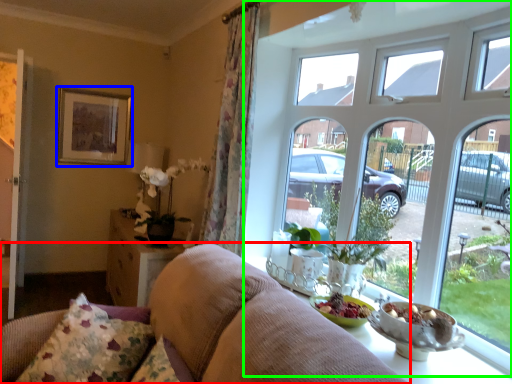
Question: Estimate the real-world distances between objects in this image. Which object is closer to studio couch (highlighted by a red box), picture frame (highlighted by a blue box) or window (highlighted by a green box)?

Choices:
 (A) picture frame
 (B) window

Answer: (B)